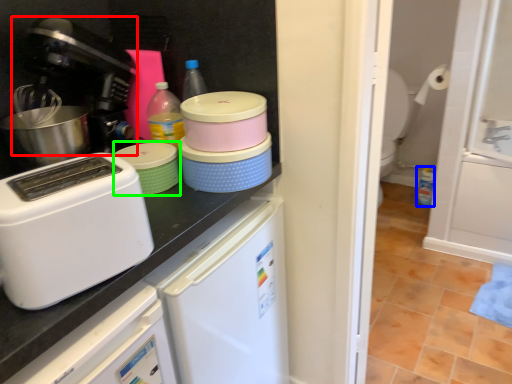
Question: Which object is positioned farthest from coffee machine (highlighted by a red box)? Select from bottle (highlighted by a blue box) and appliance (highlighted by a green box).

Choices:
 (A) bottle
 (B) appliance

Answer: (A)